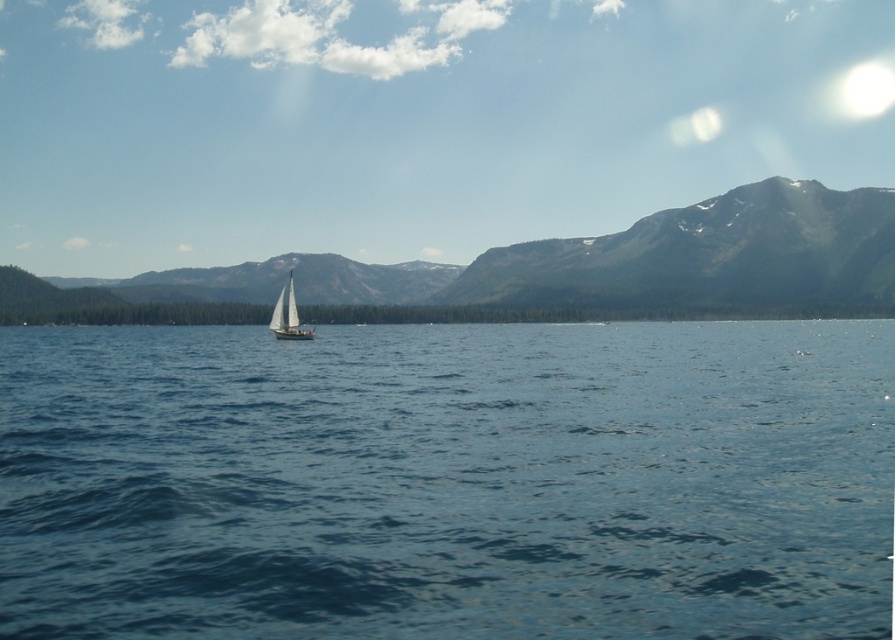
Is blue smooth water at center below white matte sailboat at center?

Yes.

Who is more distant from viewer, [171,534] or [293,324]?

The point [293,324] is more distant.

Which is behind, point (113, 586) or point (297, 314)?

The point (297, 314) is behind.

The height and width of the screenshot is (640, 895). I want to click on blue smooth water at center, so click(448, 481).

Looking at this image, does blue smooth water at center come in front of green textured mountain at center?

Yes, it is in front of green textured mountain at center.

Does blue smooth water at center have a greater height compared to green textured mountain at center?

No.

From the picture: Who is more forward, (x=547, y=586) or (x=567, y=291)?

Point (x=547, y=586) is more forward.

The width and height of the screenshot is (895, 640). I want to click on blue smooth water at center, so click(448, 481).

Is green textured mountain at center smaller than white matte sailboat at center?

No, green textured mountain at center is not smaller than white matte sailboat at center.

Does green textured mountain at center have a larger size compared to white matte sailboat at center?

Indeed, green textured mountain at center has a larger size compared to white matte sailboat at center.

Where is `green textured mountain at center`? The width and height of the screenshot is (895, 640). green textured mountain at center is located at coordinates (568, 266).